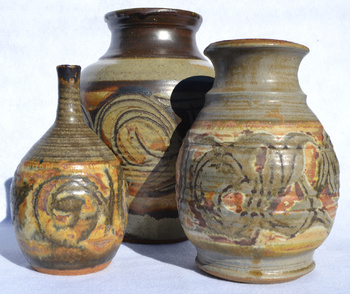
Where is `darker blue floor`? The width and height of the screenshot is (350, 294). darker blue floor is located at coordinates (328, 270).